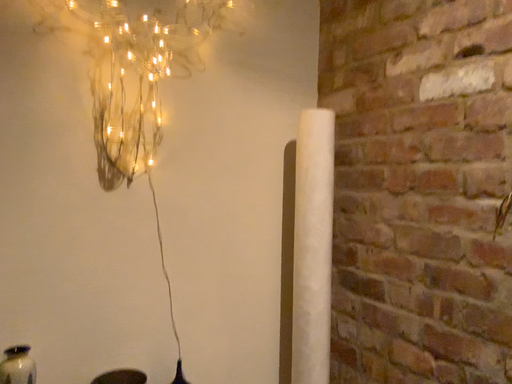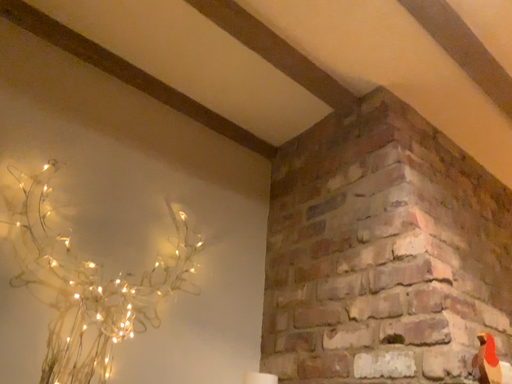
Question: How did the camera likely rotate when shooting the video?

Choices:
 (A) rotated right
 (B) rotated left

Answer: (A)